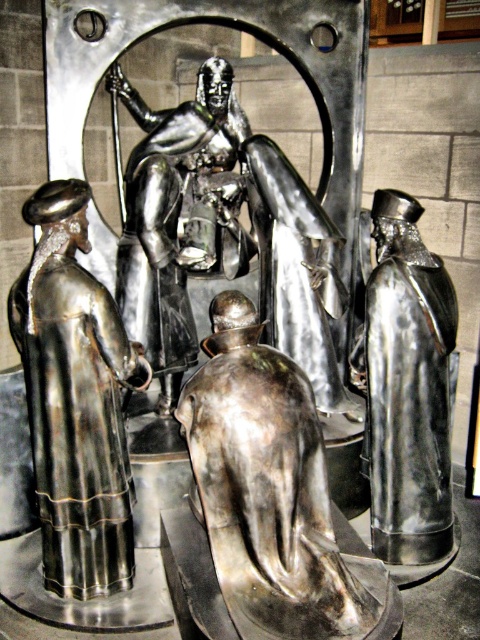
Question: Is polished silver robe at lower left above shiny silver figure at right?

Choices:
 (A) yes
 (B) no

Answer: (B)

Question: Among these points, which one is farthest from the camera?

Choices:
 (A) (61, 536)
 (B) (177, 150)
 (C) (376, 518)

Answer: (B)

Question: Considering the real-world distances, which object is closest to the polished silver knight at center?

Choices:
 (A) shiny silver figure at center
 (B) shiny silver figure at right
 (C) polished silver robe at lower left

Answer: (B)

Question: Is shiny silver figure at center to the right of polished silver robe at lower left from the viewer's perspective?

Choices:
 (A) no
 (B) yes

Answer: (B)

Question: Is shiny silver figure at center further to camera compared to shiny silver figure at right?

Choices:
 (A) no
 (B) yes

Answer: (A)

Question: Among these objects, which one is farthest from the camera?

Choices:
 (A) polished silver knight at center
 (B) polished silver robe at lower left
 (C) shiny silver figure at center
 (D) shiny silver figure at right

Answer: (A)